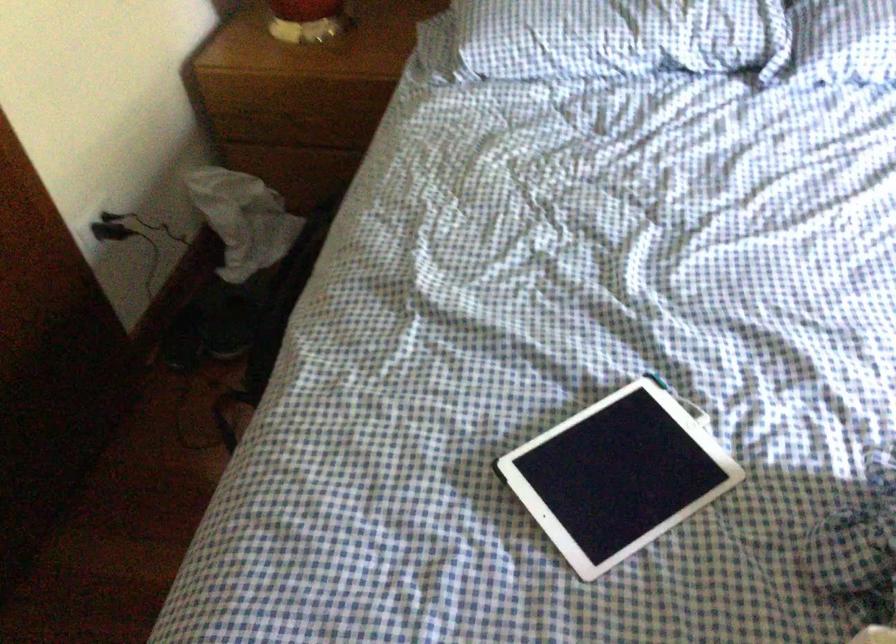
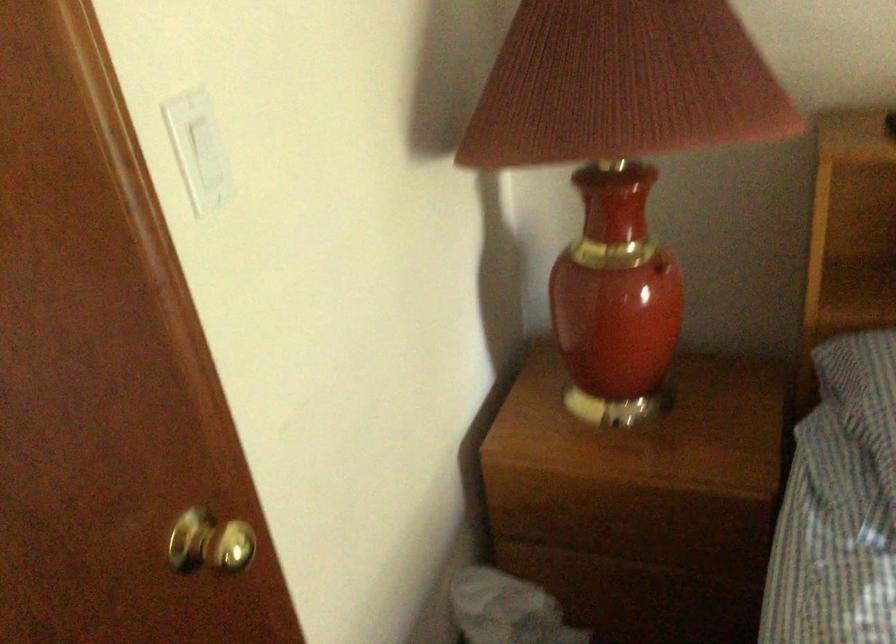
Which direction would the cameraman need to move to produce the second image?

The cameraman walked toward left, forward.